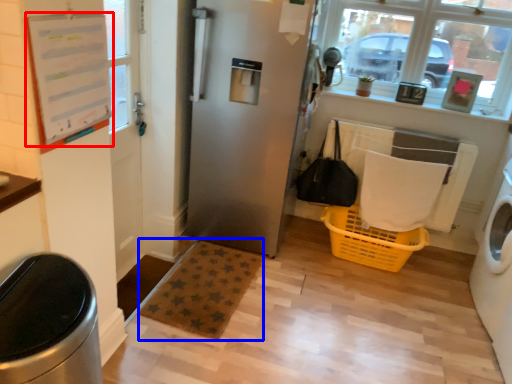
Question: Which point is closer to the camera, bulletin board (highlighted by a red box) or plain (highlighted by a blue box)?

Choices:
 (A) bulletin board
 (B) plain

Answer: (A)